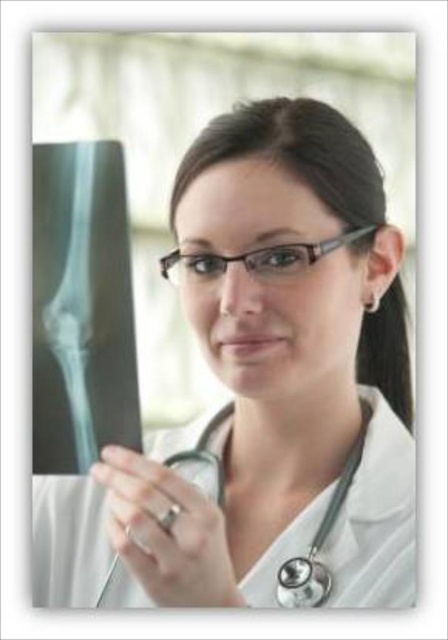
Question: Does white matte/x-ray film at center lie in front of black rubber stethoscope at center?

Choices:
 (A) yes
 (B) no

Answer: (A)

Question: Does white matte/x-ray film at center have a greater width compared to black rubber stethoscope at center?

Choices:
 (A) yes
 (B) no

Answer: (A)

Question: Among these objects, which one is farthest from the camera?

Choices:
 (A) black rubber stethoscope at center
 (B) white matte/x-ray film at center

Answer: (A)

Question: Is white matte/x-ray film at center to the left of black rubber stethoscope at center from the viewer's perspective?

Choices:
 (A) no
 (B) yes

Answer: (A)